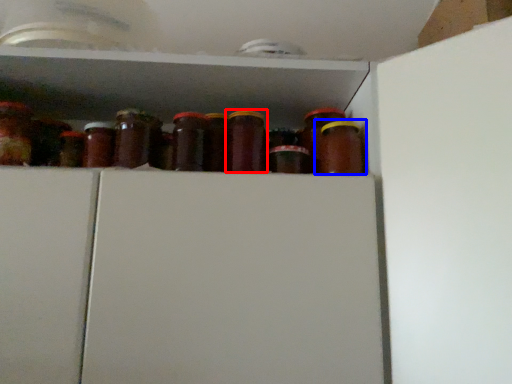
Question: Which point is closer to the camera, bottle (highlighted by a red box) or bottle (highlighted by a blue box)?

Choices:
 (A) bottle
 (B) bottle

Answer: (A)